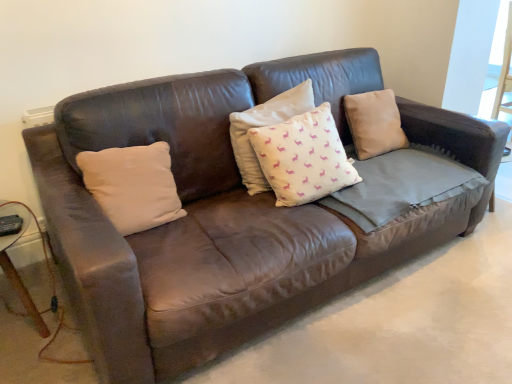
Question: Is white matte pillow at center, the 3th pillow in the right-to-left sequence, inside the boundaries of white cotton cushion at center, acting as the 2th pillow starting from the right, or outside?

Choices:
 (A) inside
 (B) outside

Answer: (B)

Question: Considering their positions, is white matte pillow at center, the 3th pillow in the right-to-left sequence, located in front of or behind white cotton cushion at center, which is the 2th pillow from left to right?

Choices:
 (A) front
 (B) behind

Answer: (A)

Question: Which of these objects is positioned closest to the white cotton cushion at center, acting as the 2th pillow starting from the right?

Choices:
 (A) white matte pillow at center, the 3th pillow in the right-to-left sequence
 (B) wooden side table at lower left
 (C) brown leather pillow at upper right, arranged as the 1th pillow when viewed from the right

Answer: (C)

Question: Estimate the real-world distances between objects in this image. Which object is closer to the brown leather pillow at upper right, arranged as the 1th pillow when viewed from the right?

Choices:
 (A) white cotton cushion at center, acting as the 2th pillow starting from the right
 (B) white matte pillow at center, acting as the first pillow starting from the left
 (C) wooden side table at lower left

Answer: (A)